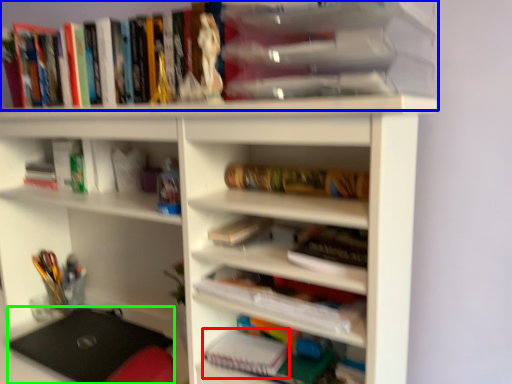
Question: Which object is the closest to the paperback book (highlighted by a red box)? Choose among these: book (highlighted by a blue box) or laptop (highlighted by a green box).

Choices:
 (A) book
 (B) laptop

Answer: (B)